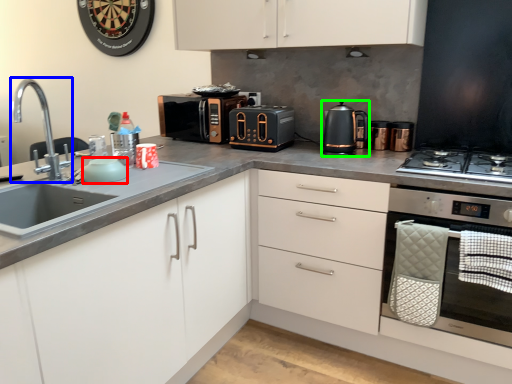
Question: Which object is positioned farthest from appliance (highlighted by a red box)? Select from tap (highlighted by a blue box) and kitchen appliance (highlighted by a green box).

Choices:
 (A) tap
 (B) kitchen appliance

Answer: (A)